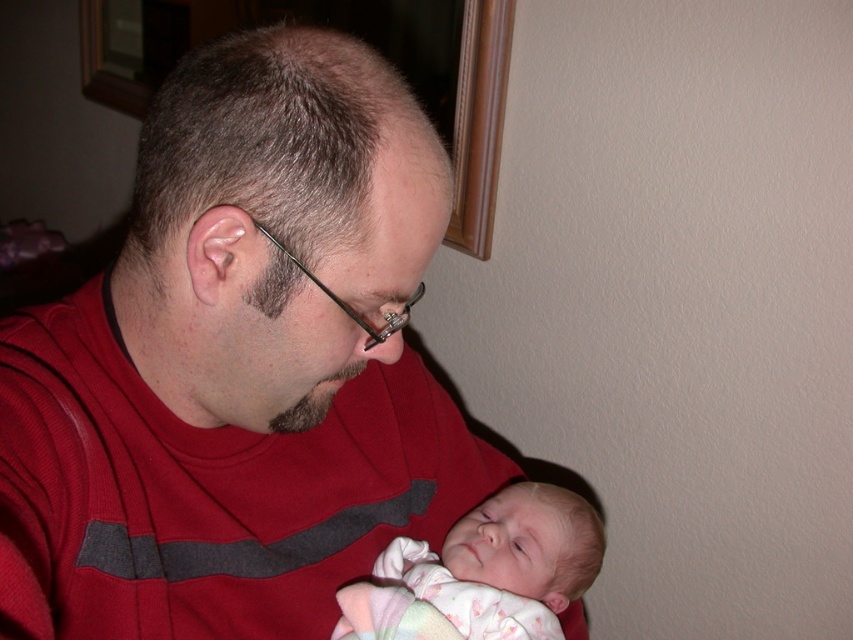
You are an interior designer planning to hang a small picture frame on the beige wall in the scene. The frame you have is exactly the same size as the existing framed picture on the wall. You want to place your new frame so that its center aligns with the point at coordinates point (238, 364). However, you notice that this point is on an object in the scene. Which object is it on?

The point (238, 364) is on the matte red shirt at center.

You are a fashion designer observing the image. You need to determine which item of clothing is higher in height between the matte red shirt at center and the soft pink fabric at center. Which one is taller?

The matte red shirt at center is taller than the soft pink fabric at center according to the description.